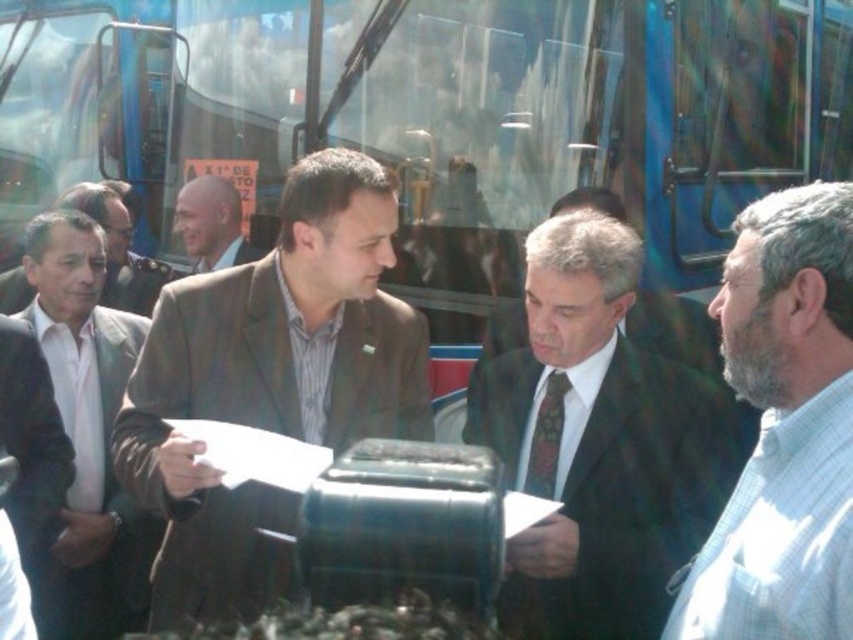
Question: Which object is closer to the camera taking this photo?

Choices:
 (A) white checkered shirt at right
 (B) light brown textured jacket at center
 (C) brown textured suit at center
 (D) dark suit at center

Answer: (A)

Question: Which point appears farthest from the camera in this image?

Choices:
 (A) (125, 307)
 (B) (683, 451)
 (C) (219, 257)

Answer: (C)

Question: Is white matte suit at left wider than light brown textured jacket at center?

Choices:
 (A) no
 (B) yes

Answer: (B)

Question: Does matte brown suit at left come in front of light brown textured jacket at center?

Choices:
 (A) yes
 (B) no

Answer: (A)

Question: Which object is closer to the camera taking this photo?

Choices:
 (A) dark suit at center
 (B) dark brown fabric suit at center
 (C) light brown textured jacket at center
 (D) white checkered shirt at right

Answer: (D)

Question: Where is white checkered shirt at right located in relation to light brown textured jacket at center in the image?

Choices:
 (A) right
 (B) left

Answer: (A)